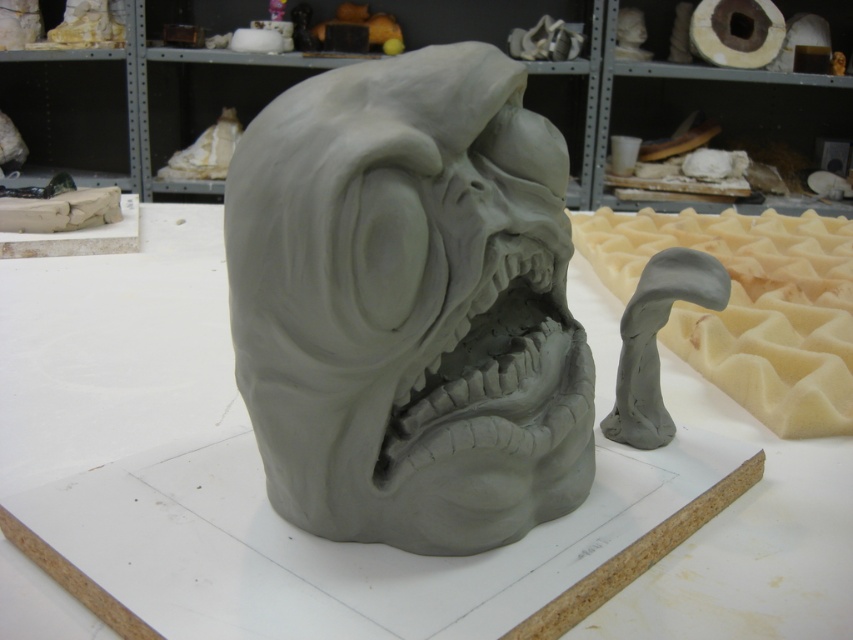
Is gray clay sculpture at center smaller than gray clay mouth at center?

No.

Who is positioned more to the right, gray clay sculpture at center or gray clay mouth at center?

From the viewer's perspective, gray clay mouth at center appears more on the right side.

Who is more forward, [309,531] or [445,424]?

Point [445,424]

Image resolution: width=853 pixels, height=640 pixels. I want to click on gray clay sculpture at center, so click(409, 305).